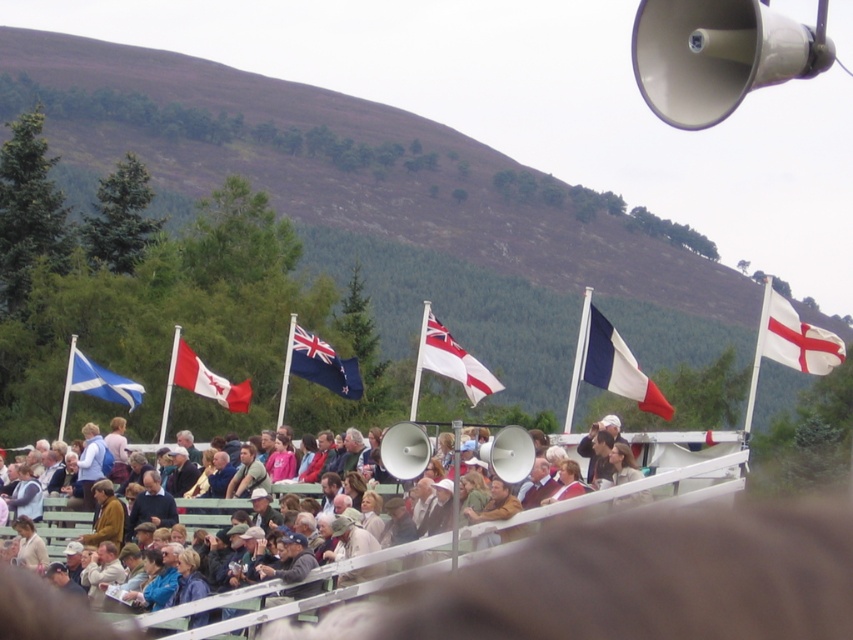
Does white fabric flag at upper right appear over white/blue/red fabric flag at center?

Yes.

Which is above, white fabric flag at upper right or white/blue/red fabric flag at center?

white fabric flag at upper right

Where is `white fabric flag at upper right`? The width and height of the screenshot is (853, 640). white fabric flag at upper right is located at coordinates click(793, 337).

Between white plastic megaphone at upper right and white plastic megaphone at center, which one appears on the left side from the viewer's perspective?

white plastic megaphone at center is more to the left.

Describe the element at coordinates (718, 54) in the screenshot. I see `white plastic megaphone at upper right` at that location.

Locate an element on the screen. white plastic megaphone at upper right is located at coordinates (718, 54).

Between white/blue/red fabric flag at center and white fabric flag at center, which one is positioned higher?

white fabric flag at center is above.

The height and width of the screenshot is (640, 853). What do you see at coordinates (618, 365) in the screenshot?
I see `white/blue/red fabric flag at center` at bounding box center [618, 365].

The height and width of the screenshot is (640, 853). Identify the location of white/blue/red fabric flag at center. (618, 365).